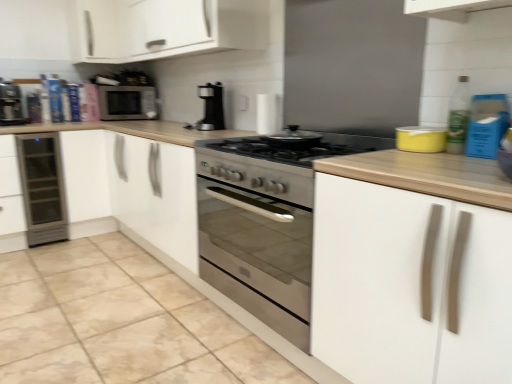
In order to click on free space to the left of green plastic bottle at upper right in this screenshot , I will do `click(407, 158)`.